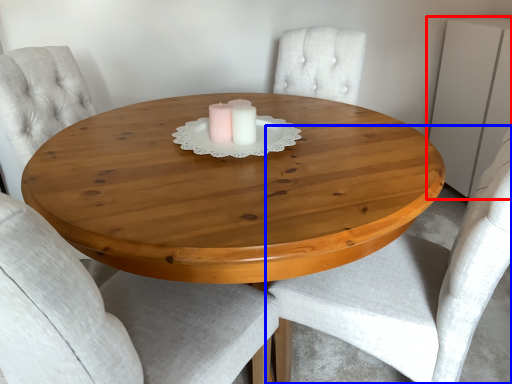
Question: Which point is further to the camera, dresser (highlighted by a red box) or chair (highlighted by a blue box)?

Choices:
 (A) dresser
 (B) chair

Answer: (A)